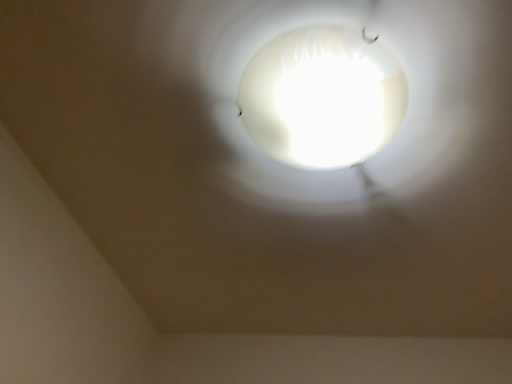
What do you see at coordinates (322, 97) in the screenshot?
I see `white frosted glass light bulb at upper center` at bounding box center [322, 97].

At what (x,y) coordinates should I click in order to perform the action: click on white frosted glass light bulb at upper center. Please return your answer as a coordinate pair (x, y). Looking at the image, I should click on (322, 97).

I want to click on white frosted glass light bulb at upper center, so click(322, 97).